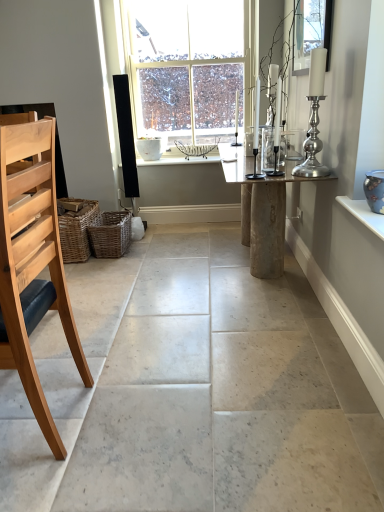
Question: From a real-world perspective, is blue glossy vase at upper right located higher than woven brown basket at lower left, arranged as the second basket when viewed from the right?

Choices:
 (A) no
 (B) yes

Answer: (B)

Question: Considering the relative sizes of blue glossy vase at upper right and woven brown basket at lower left, arranged as the second basket when viewed from the right, in the image provided, is blue glossy vase at upper right thinner than woven brown basket at lower left, arranged as the second basket when viewed from the right,?

Choices:
 (A) yes
 (B) no

Answer: (A)

Question: Is blue glossy vase at upper right shorter than woven brown basket at lower left, arranged as the 1th basket when viewed from the left?

Choices:
 (A) no
 (B) yes

Answer: (B)

Question: From the image's perspective, is blue glossy vase at upper right on woven brown basket at lower left, arranged as the second basket when viewed from the right?

Choices:
 (A) no
 (B) yes

Answer: (B)

Question: From the image's perspective, is blue glossy vase at upper right under woven brown basket at lower left, arranged as the 1th basket when viewed from the left?

Choices:
 (A) no
 (B) yes

Answer: (A)

Question: Would you say blue glossy vase at upper right is to the left or to the right of rustic wood table at center in the picture?

Choices:
 (A) left
 (B) right

Answer: (B)

Question: Considering the positions of blue glossy vase at upper right and rustic wood table at center in the image, is blue glossy vase at upper right bigger or smaller than rustic wood table at center?

Choices:
 (A) small
 (B) big

Answer: (A)

Question: Is blue glossy vase at upper right taller or shorter than rustic wood table at center?

Choices:
 (A) tall
 (B) short

Answer: (B)

Question: Looking at their shapes, would you say blue glossy vase at upper right is wider or thinner than rustic wood table at center?

Choices:
 (A) thin
 (B) wide

Answer: (A)

Question: Considering the positions of point (326, 28) and point (67, 229), is point (326, 28) closer or farther from the camera than point (67, 229)?

Choices:
 (A) farther
 (B) closer

Answer: (B)

Question: Would you say clear glass candlestick at upper right is to the left or to the right of woven brown basket at lower left, arranged as the second basket when viewed from the right, in the picture?

Choices:
 (A) left
 (B) right

Answer: (B)

Question: Considering the positions of clear glass candlestick at upper right and woven brown basket at lower left, arranged as the second basket when viewed from the right, in the image, is clear glass candlestick at upper right bigger or smaller than woven brown basket at lower left, arranged as the second basket when viewed from the right,?

Choices:
 (A) small
 (B) big

Answer: (A)

Question: Choose the correct answer: Is clear glass candlestick at upper right inside woven brown basket at lower left, arranged as the 1th basket when viewed from the left, or outside it?

Choices:
 (A) inside
 (B) outside

Answer: (B)

Question: Based on their sizes in the image, would you say clear glass candlestick at upper right is bigger or smaller than natural wood chair at left?

Choices:
 (A) big
 (B) small

Answer: (B)

Question: Is clear glass candlestick at upper right spatially inside natural wood chair at left, or outside of it?

Choices:
 (A) outside
 (B) inside

Answer: (A)